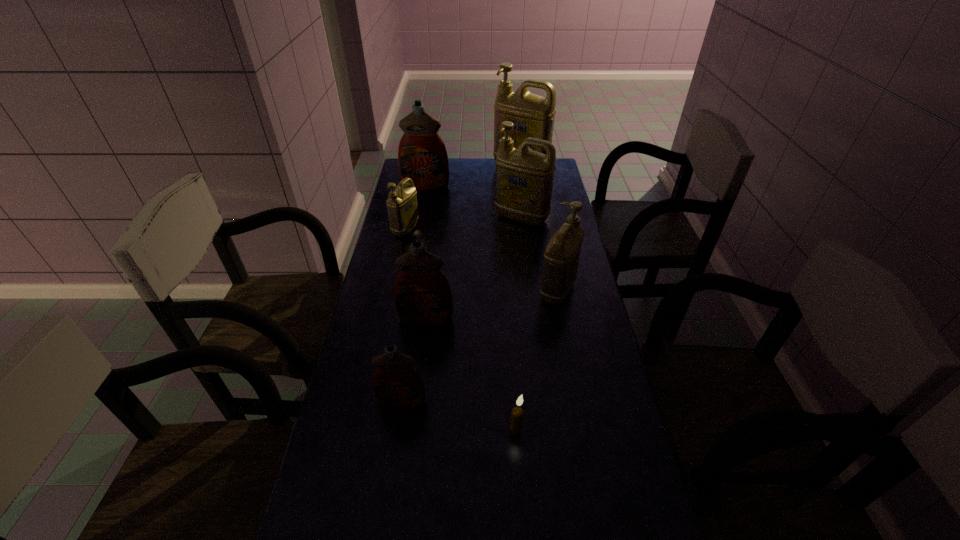
This screenshot has width=960, height=540. What are the coordinates of `vacant region between the nearest beige detergent and the nearest detergent` in the screenshot? It's located at tap(480, 346).

This screenshot has width=960, height=540. What are the coordinates of `unoccupied area between the nearest object and the tallest detergent` in the screenshot? It's located at (518, 298).

The image size is (960, 540). In order to click on vacant region between the nearest red detergent and the nearest object in this screenshot , I will do `click(459, 415)`.

Identify which object is located as the third nearest to the cream candle. Please provide its 2D coordinates. Your answer should be formatted as a tuple, i.e. [(x, y)], where the tuple contains the x and y coordinates of a point satisfying the conditions above.

[(561, 257)]

Where is `object that stands as the seventh closest to the biggest beige detergent`? The height and width of the screenshot is (540, 960). object that stands as the seventh closest to the biggest beige detergent is located at coordinates (517, 413).

This screenshot has height=540, width=960. Identify the location of detergent that is the sixth closest to the tallest object. (397, 385).

Point out which detergent is positioned as the second nearest to the farthest detergent. Please provide its 2D coordinates. Your answer should be formatted as a tuple, i.e. [(x, y)], where the tuple contains the x and y coordinates of a point satisfying the conditions above.

[(524, 178)]

Find the location of `the second closest beige detergent to the leftmost beige detergent`. the second closest beige detergent to the leftmost beige detergent is located at coordinates (533, 116).

Identify which beige detergent is the fourth nearest to the seventh farthest object. Please provide its 2D coordinates. Your answer should be formatted as a tuple, i.e. [(x, y)], where the tuple contains the x and y coordinates of a point satisfying the conditions above.

[(533, 116)]

Find the location of a particular element. red detergent that can be found as the third closest to the second smallest beige detergent is located at coordinates (422, 156).